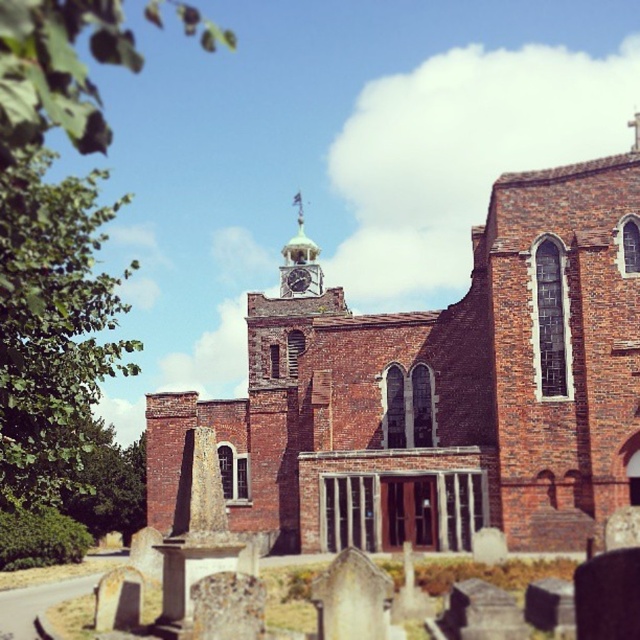
Between brick church at center and green painted metal clock tower at upper center, which one is positioned higher?

Positioned higher is green painted metal clock tower at upper center.

From the picture: Is brick church at center behind green painted metal clock tower at upper center?

No, brick church at center is in front of green painted metal clock tower at upper center.

Between point (320, 506) and point (284, 266), which one is positioned behind?

The point (284, 266) is behind.

Locate an element on the screen. brick church at center is located at coordinates (444, 390).

Can you confirm if green painted metal clock tower at upper center is shorter than matte black clock at center?

In fact, green painted metal clock tower at upper center may be taller than matte black clock at center.

Between point (291, 268) and point (296, 282), which one is positioned behind?

Positioned behind is point (291, 268).

The width and height of the screenshot is (640, 640). I want to click on green painted metal clock tower at upper center, so click(x=300, y=262).

Does point (445, 364) lie in front of point (305, 269)?

Yes.

Consider the image. Which is more to the right, brick church at center or matte black clock at center?

brick church at center

I want to click on brick church at center, so click(444, 390).